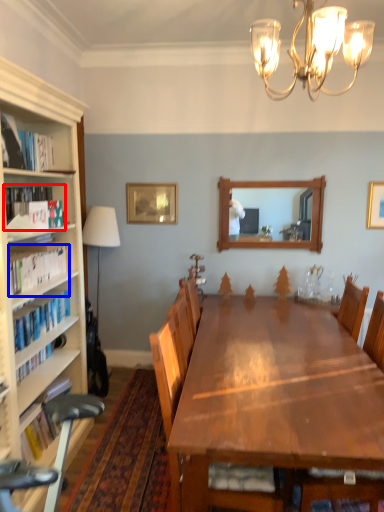
Question: Among these objects, which one is farthest to the camera, book (highlighted by a red box) or book (highlighted by a blue box)?

Choices:
 (A) book
 (B) book

Answer: (A)